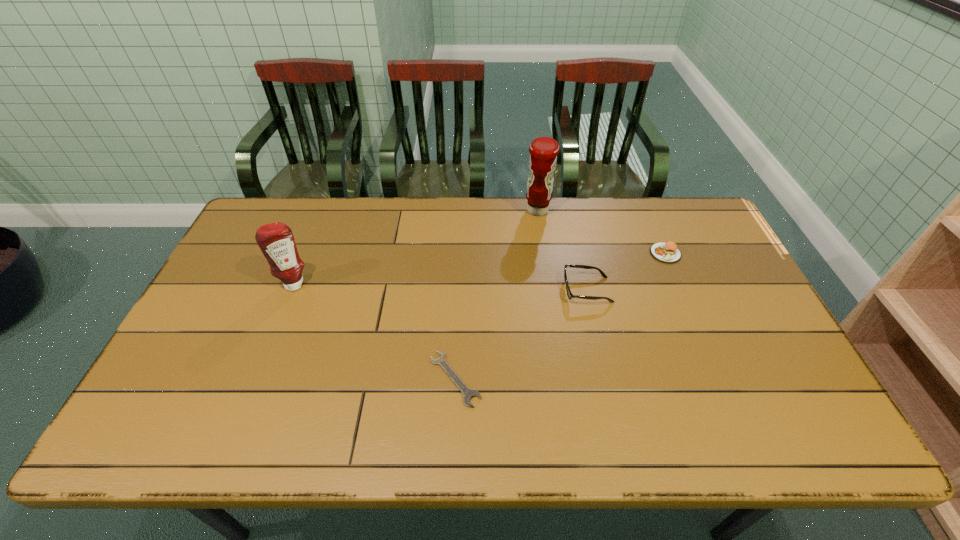
Locate an element on the screen. The width and height of the screenshot is (960, 540). empty location between the third tallest object and the leftmost object is located at coordinates (441, 287).

Where is `free space between the rightmost object and the shorter condiment`? Image resolution: width=960 pixels, height=540 pixels. free space between the rightmost object and the shorter condiment is located at coordinates (480, 269).

Identify the location of vacant area that lies between the second shortest object and the wrench. (560, 316).

Identify the location of free point between the shortest object and the leftmost object. This screenshot has width=960, height=540. (374, 332).

At what (x,y) coordinates should I click in order to perform the action: click on empty space that is in between the taller condiment and the rightmost object. Please return your answer as a coordinate pair (x, y). This screenshot has height=540, width=960. Looking at the image, I should click on (601, 232).

Locate an element on the screen. free spot between the fourth object from right to left and the third tallest object is located at coordinates (521, 334).

The height and width of the screenshot is (540, 960). Identify the location of object that is the closest to the second object from left to right. (569, 294).

Identify the location of object that can be found as the fourth closest to the second object from left to right. point(668,252).

Locate an element on the screen. This screenshot has width=960, height=540. vacant space that satisfies the following two spatial constraints: 1. on the front side of the fourth tallest object; 2. on the lenses of the spectacles is located at coordinates (681, 290).